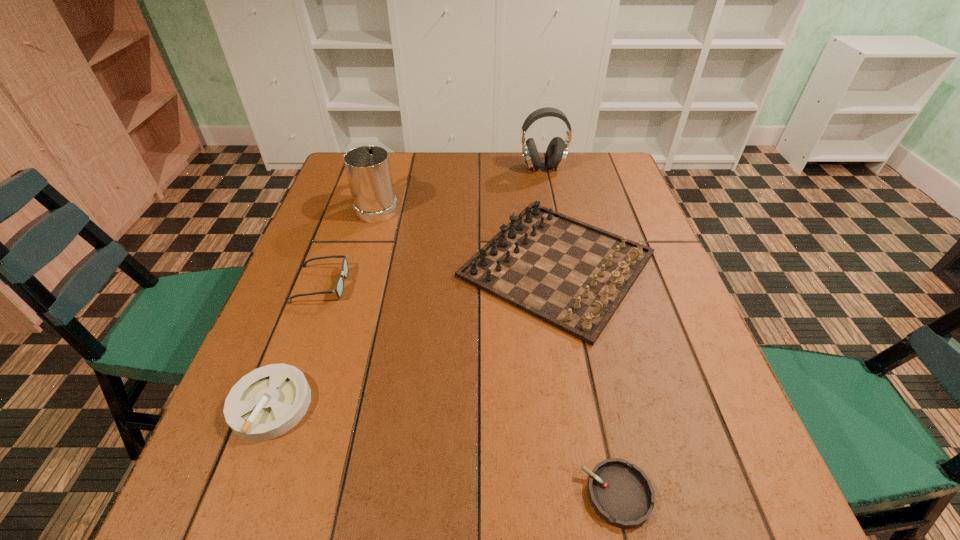
Identify the location of free spot between the mug and the farthest object. (460, 186).

Identify the location of vacant point located between the spectacles and the mug. This screenshot has width=960, height=540. (349, 245).

The image size is (960, 540). In order to click on vacant area that lies between the spectacles and the mug in this screenshot , I will do `click(349, 245)`.

The image size is (960, 540). I want to click on vacant point located between the spectacles and the mug, so click(x=349, y=245).

At what (x,y) coordinates should I click in order to perform the action: click on vacant space that's between the farthest object and the mug. Please return your answer as a coordinate pair (x, y). This screenshot has width=960, height=540. Looking at the image, I should click on (460, 186).

The width and height of the screenshot is (960, 540). I want to click on unoccupied area between the fourth shortest object and the taller ashtray, so click(x=414, y=334).

Where is `vacant area that lies between the mug and the nearer ashtray`? vacant area that lies between the mug and the nearer ashtray is located at coordinates (497, 349).

You are a GUI agent. You are given a task and a screenshot of the screen. Output one action in this format:
    pyautogui.click(x=<x>, y=<y>)
    Task: Click on the free area in between the nearest object and the chessboard
    This screenshot has width=960, height=540.
    Given the screenshot: What is the action you would take?
    pyautogui.click(x=587, y=380)

The image size is (960, 540). Identify the location of vacant area that lies between the spectacles and the left ashtray. (296, 344).

Where is `the closest object to the fifth farthest object`? Image resolution: width=960 pixels, height=540 pixels. the closest object to the fifth farthest object is located at coordinates (339, 287).